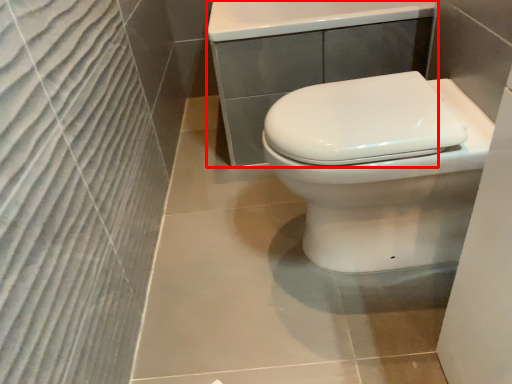
Question: Observing the image, what is the correct spatial positioning of porcelain (annotated by the red box) in reference to toilet?

Choices:
 (A) right
 (B) left

Answer: (A)